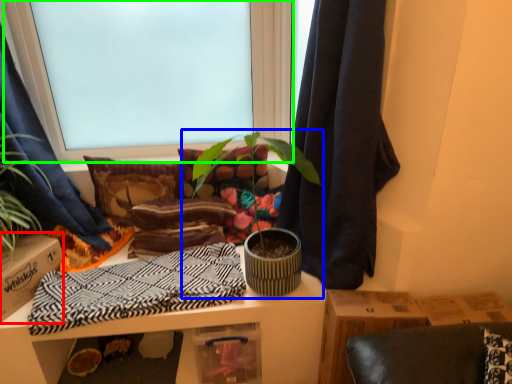
Question: Which is farther away from cardboard box (highlighted by a red box)? houseplant (highlighted by a blue box) or window (highlighted by a green box)?

Choices:
 (A) houseplant
 (B) window

Answer: (B)